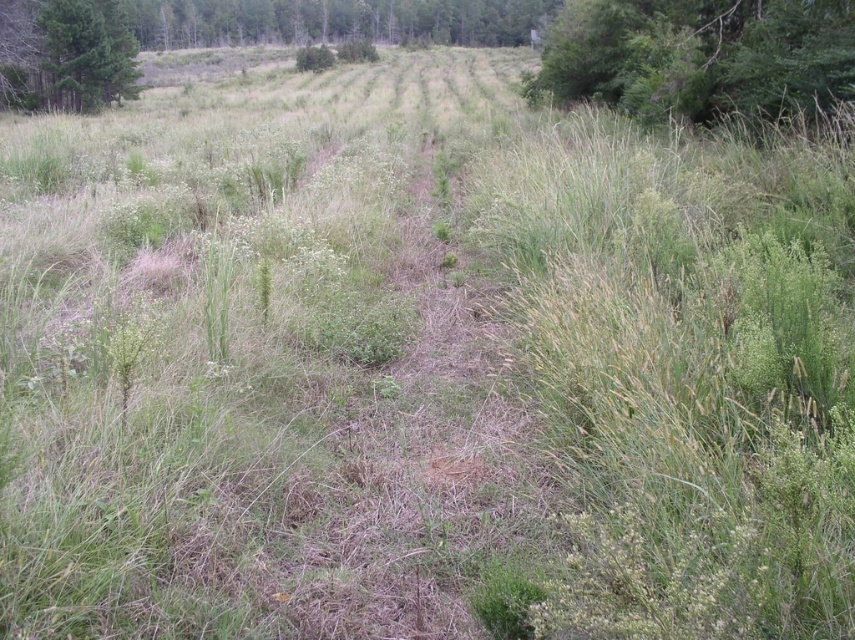
You are standing at the point with coordinates point (x=699, y=54) in the image. Which object from the scene are you closest to?

You are closest to the green leafy tree at upper right because point (x=699, y=54) corresponds to that object.

You are a hiker trying to navigate through this landscape. You notice two trees in the distance, the green leafy tree at upper right and the green matte tree at upper left. Which tree would appear smaller in the landscape?

The green leafy tree at upper right occupies less space than the green matte tree at upper left, so it would appear smaller in the landscape.